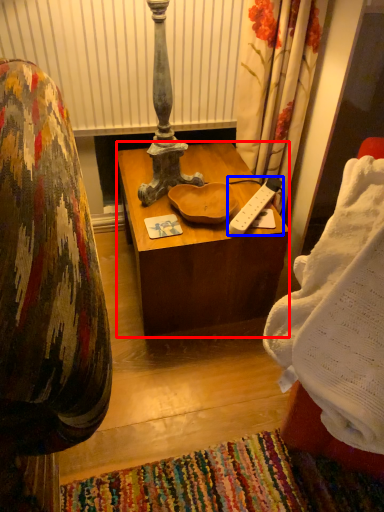
Question: Among these objects, which one is farthest to the camera, desk (highlighted by a red box) or remote control (highlighted by a blue box)?

Choices:
 (A) desk
 (B) remote control

Answer: (B)